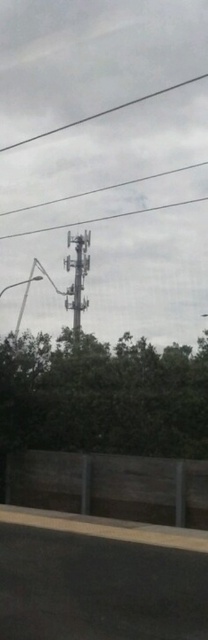
You are standing on the road in front of the fence and see both the green leafy tree at center and the metallic gray tower at center. Which object is closer to you?

The green leafy tree at center is closer to you because it is in front of the metallic gray tower at center.